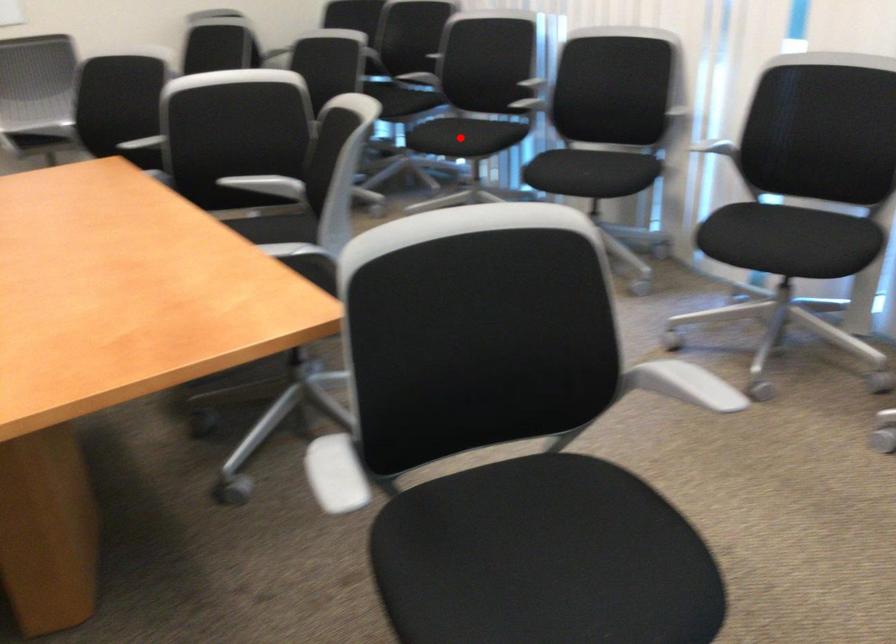
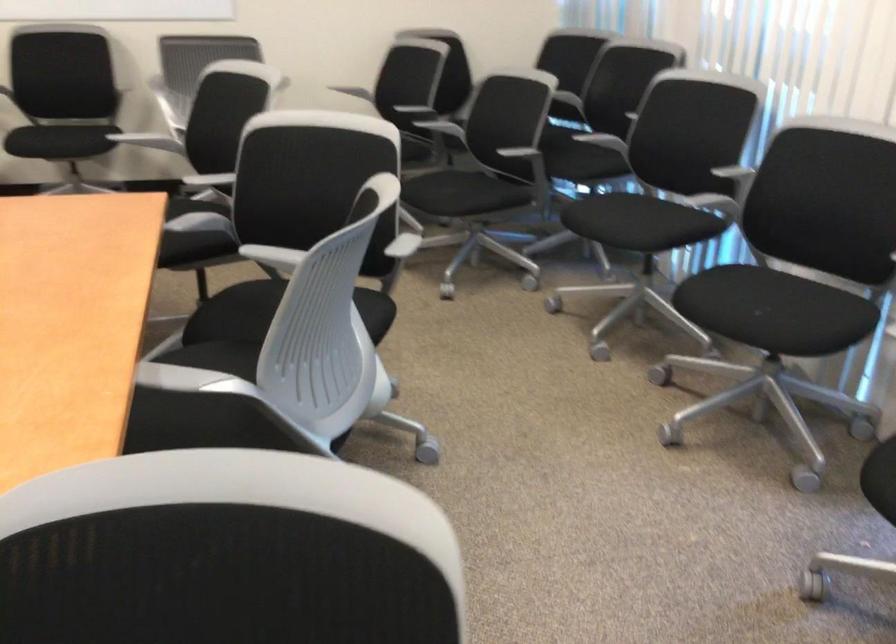
Find the pixel in the second image that matches the highlighted location in the first image.

(624, 221)